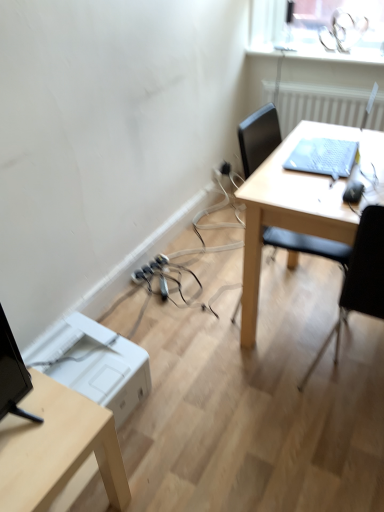
What are the coordinates of `free spot to the left of white textured radiator at upper right` in the screenshot? It's located at (276, 170).